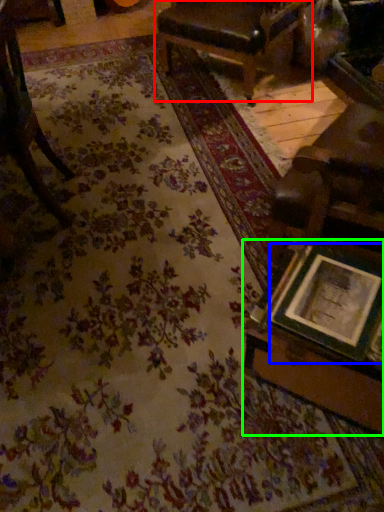
Question: Based on their relative distances, which object is nearer to chair (highlighted by a red box)? Choose from picture frame (highlighted by a blue box) and table (highlighted by a green box).

Choices:
 (A) picture frame
 (B) table

Answer: (B)